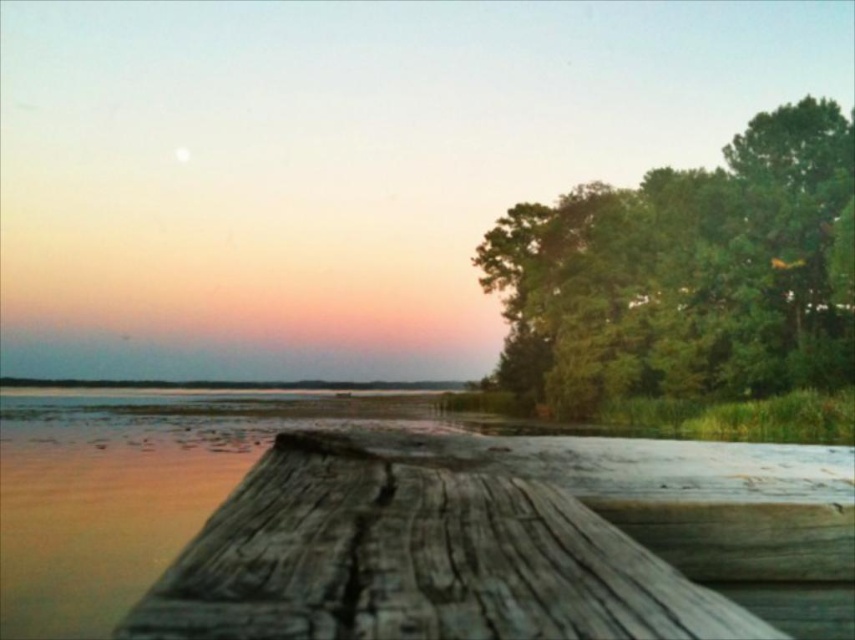
You are a painter standing at the lakeside. You want to paint the weathered wood dock at center and the green leafy tree at upper right. Which object should you focus on first if you want to capture the one that takes up less space horizontally in your painting?

The weathered wood dock at center has a lesser width compared to the green leafy tree at upper right, so you should focus on painting the weathered wood dock at center first since it takes up less horizontal space in the painting.

You are standing at the edge of the lakeside and want to determine which of the two points, point (380, 499) or point (540, 344), is nearer to you. Based on the scene, can you identify the closer point?

Point (380, 499) is closer to the viewer than point (540, 344).

You are standing on the weathered wood dock at center and want to look up at the green leafy tree at upper right. In which direction should you look?

You should look upward because the green leafy tree at upper right is above the weathered wood dock at center.